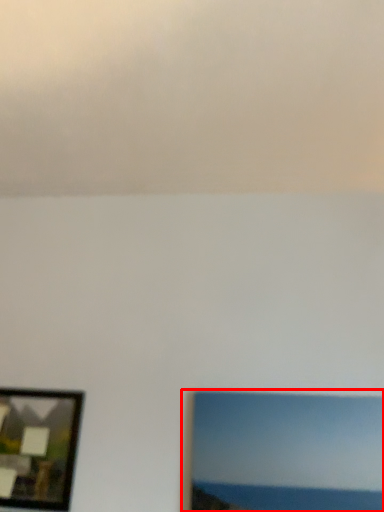
Question: Where is picture frame (annotated by the red box) located in relation to picture frame in the image?

Choices:
 (A) right
 (B) left

Answer: (A)